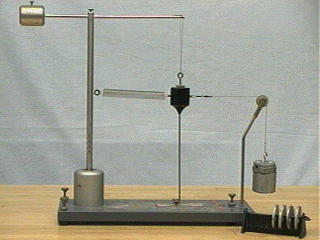
The height and width of the screenshot is (240, 320). I want to click on table top, so click(x=40, y=209).